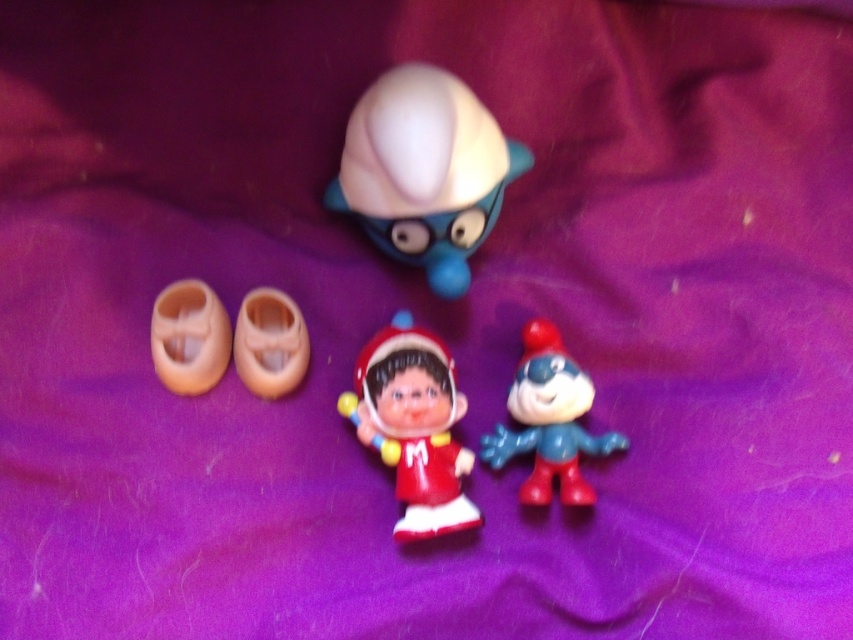
Does smooth plastic toy at center lie in front of translucent plastic shoes at center?

Yes, it is.

I want to click on smooth plastic toy at center, so click(x=548, y=420).

Does beige rubber shoes at lower left appear under translucent plastic shoes at center?

No, beige rubber shoes at lower left is not below translucent plastic shoes at center.

The image size is (853, 640). What do you see at coordinates (189, 337) in the screenshot?
I see `beige rubber shoes at lower left` at bounding box center [189, 337].

Does point (213, 308) lie behind point (241, 358)?

That is False.

Image resolution: width=853 pixels, height=640 pixels. I want to click on beige rubber shoes at lower left, so click(x=189, y=337).

Looking at this image, can you confirm if matte red plastic figure at center is wider than translucent plastic shoes at center?

Indeed, matte red plastic figure at center has a greater width compared to translucent plastic shoes at center.

Who is lower down, matte red plastic figure at center or translucent plastic shoes at center?

matte red plastic figure at center is below.

Which is behind, point (439, 449) or point (277, 298)?

Point (277, 298)

Identify the location of matte red plastic figure at center. (415, 426).